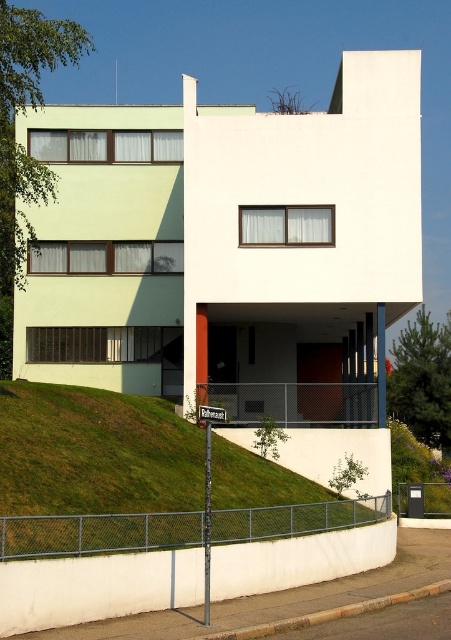
Question: Can you confirm if chain-link fence at lower right is wider than metallic chain-link fence at lower center?

Choices:
 (A) no
 (B) yes

Answer: (B)

Question: Does green grass at lower left have a larger size compared to metallic chain-link fence at lower center?

Choices:
 (A) yes
 (B) no

Answer: (A)

Question: Can you confirm if green grass at lower left is positioned to the right of chain-link fence at lower right?

Choices:
 (A) yes
 (B) no

Answer: (B)

Question: Among these objects, which one is farthest from the camera?

Choices:
 (A) metallic chain-link fence at lower center
 (B) chain-link fence at lower right
 (C) green grass at lower left

Answer: (A)

Question: Based on their relative distances, which object is farther from the metallic chain-link fence at lower center?

Choices:
 (A) chain-link fence at lower right
 (B) green grass at lower left

Answer: (A)

Question: Which point is farther from the camera taking this photo?

Choices:
 (A) [x=30, y=525]
 (B) [x=245, y=385]

Answer: (B)